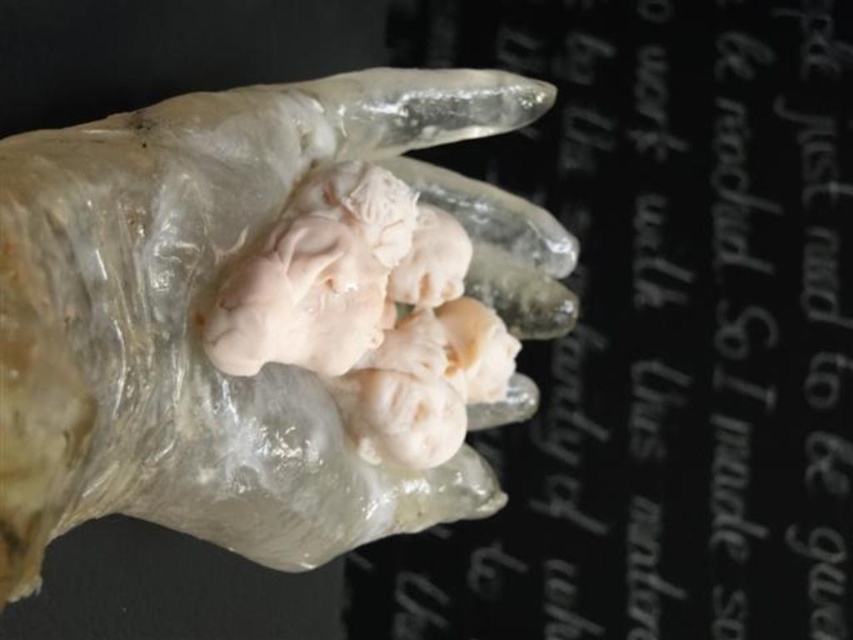
Question: From the image, what is the correct spatial relationship of black glossy text at upper center in relation to translucent rubber hand at center?

Choices:
 (A) left
 (B) right

Answer: (B)

Question: Considering the relative positions of black glossy text at upper center and translucent rubber hand at center in the image provided, where is black glossy text at upper center located with respect to translucent rubber hand at center?

Choices:
 (A) left
 (B) right

Answer: (B)

Question: Observing the image, what is the correct spatial positioning of black glossy text at upper center in reference to translucent rubber hand at center?

Choices:
 (A) above
 (B) below

Answer: (A)

Question: Which point appears farthest from the camera in this image?

Choices:
 (A) (425, 83)
 (B) (573, 416)

Answer: (B)

Question: Which of the following is the farthest from the observer?

Choices:
 (A) translucent rubber hand at center
 (B) black glossy text at upper center

Answer: (B)